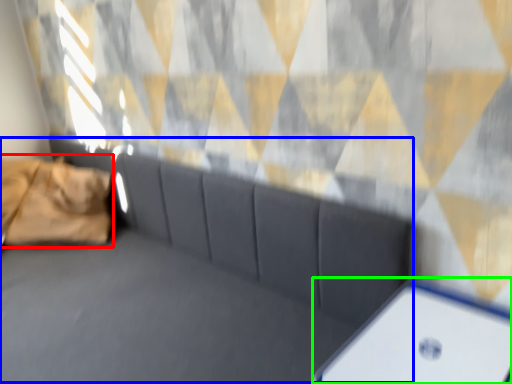
Question: Based on their relative distances, which object is farther from pillow (highlighted by a red box)? Choose from couch (highlighted by a blue box) and furniture (highlighted by a green box).

Choices:
 (A) couch
 (B) furniture

Answer: (B)